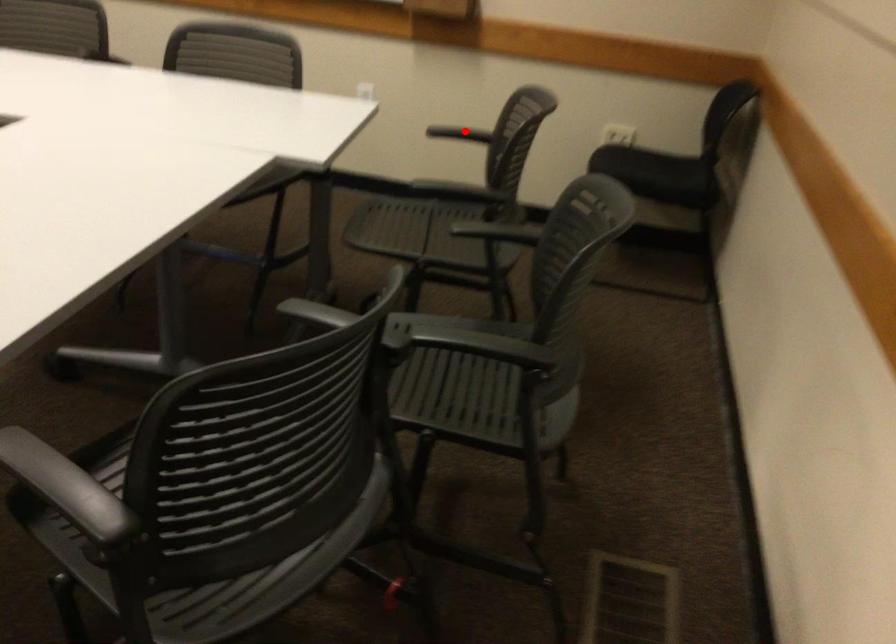
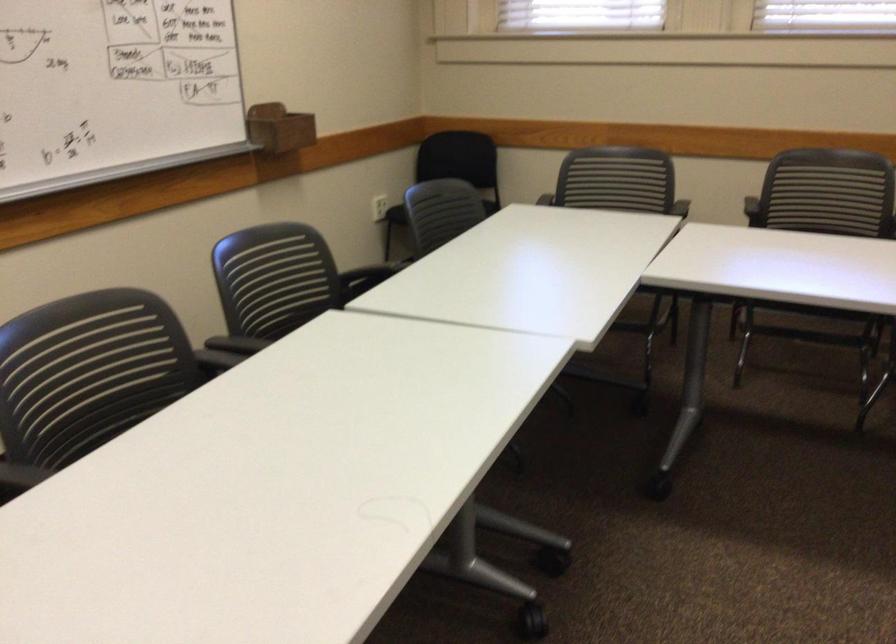
Question: I am providing you with two images of the same scene from different viewpoints. A red point is marked on the first image. Is the red point's position out of view in image 2?

Choices:
 (A) Yes
 (B) No

Answer: (A)